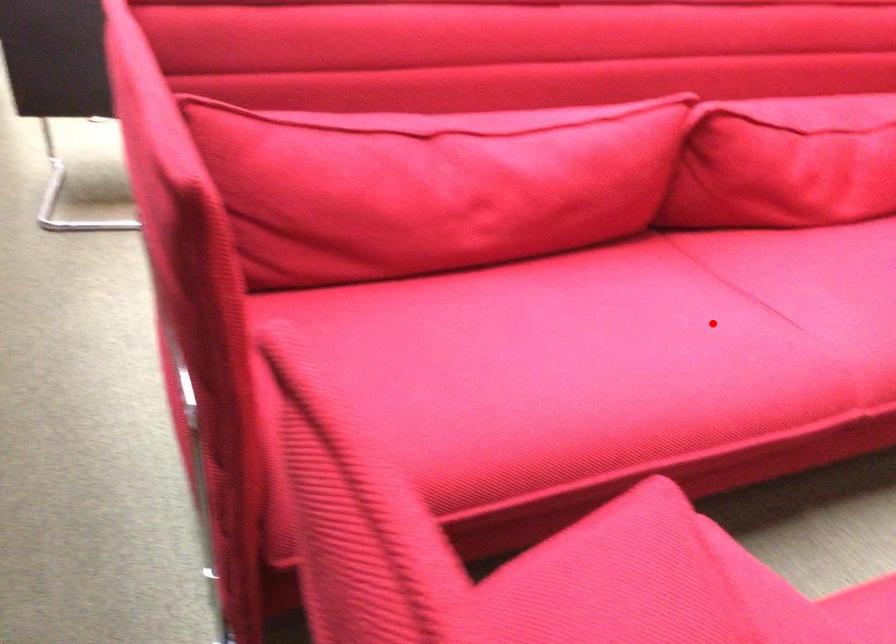
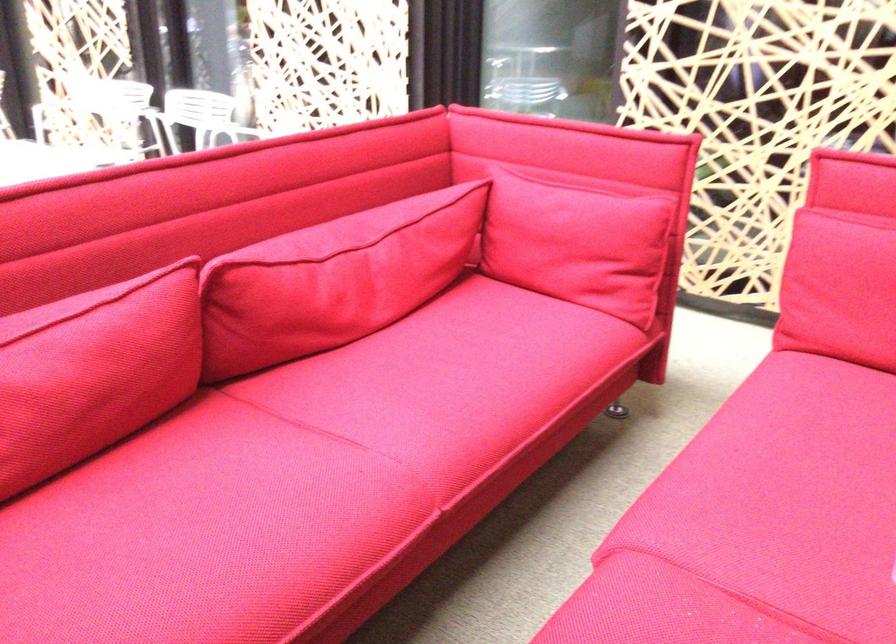
Where in the second image is the point corresponding to the highlighted location from the first image?

(298, 476)